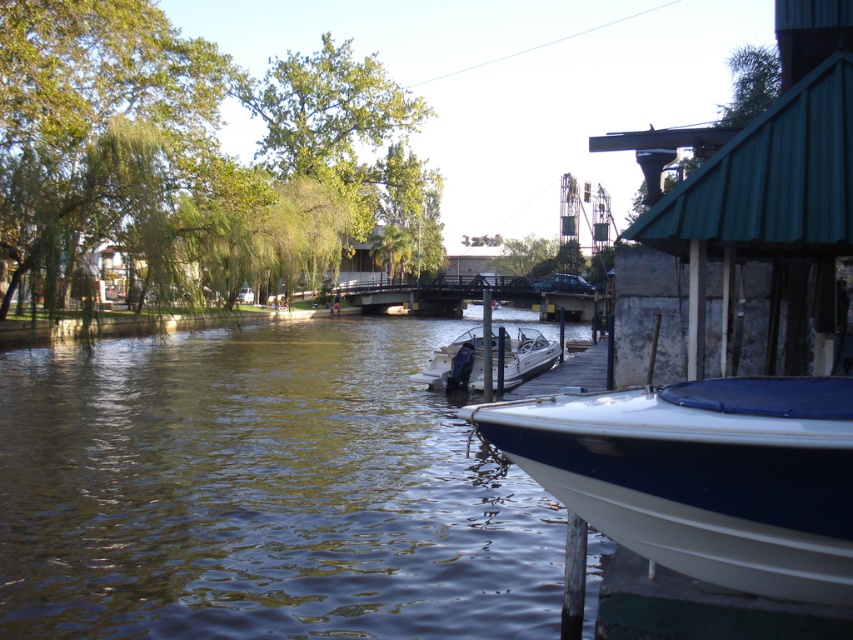
Is point (96, 144) behind point (608, 522)?

Yes, point (96, 144) is behind point (608, 522).

Is point (80, 115) farther from viewer compared to point (537, 480)?

Yes, point (80, 115) is farther from viewer.

Identify the location of green leafy tree at upper left. (173, 154).

Is white glossy boat at lower right positioned behind white glossy motorboat at center?

No, white glossy boat at lower right is in front of white glossy motorboat at center.

Is white glossy boat at lower right positioned in front of white glossy motorboat at center?

Yes, white glossy boat at lower right is in front of white glossy motorboat at center.

Where is `white glossy boat at lower right`? The image size is (853, 640). white glossy boat at lower right is located at coordinates (703, 476).

Does point (750, 88) lie in front of point (520, 259)?

Yes, point (750, 88) is closer to viewer.

The image size is (853, 640). What do you see at coordinates (750, 84) in the screenshot?
I see `green leafy tree at upper center` at bounding box center [750, 84].

The height and width of the screenshot is (640, 853). What are the coordinates of `green leafy tree at upper center` in the screenshot? It's located at (750, 84).